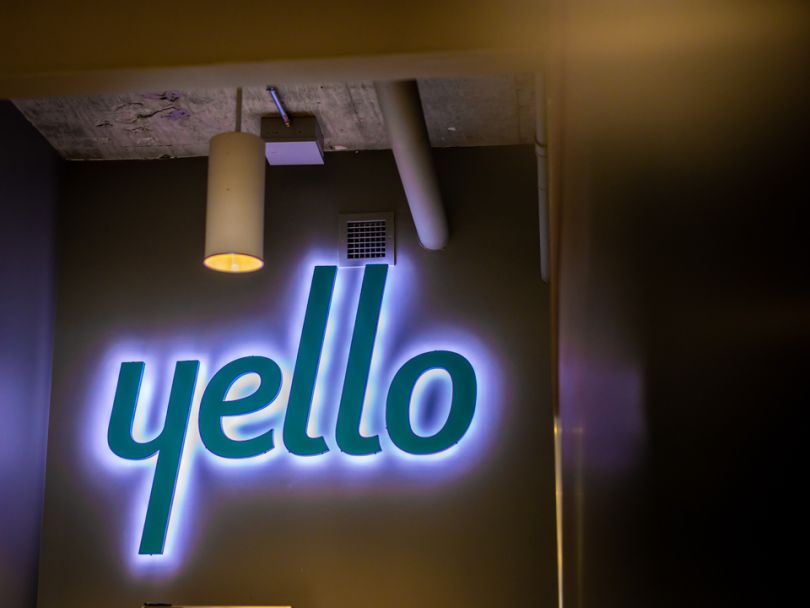
Locate an element on the screen. This screenshot has height=608, width=810. hanging light is located at coordinates (232, 229).